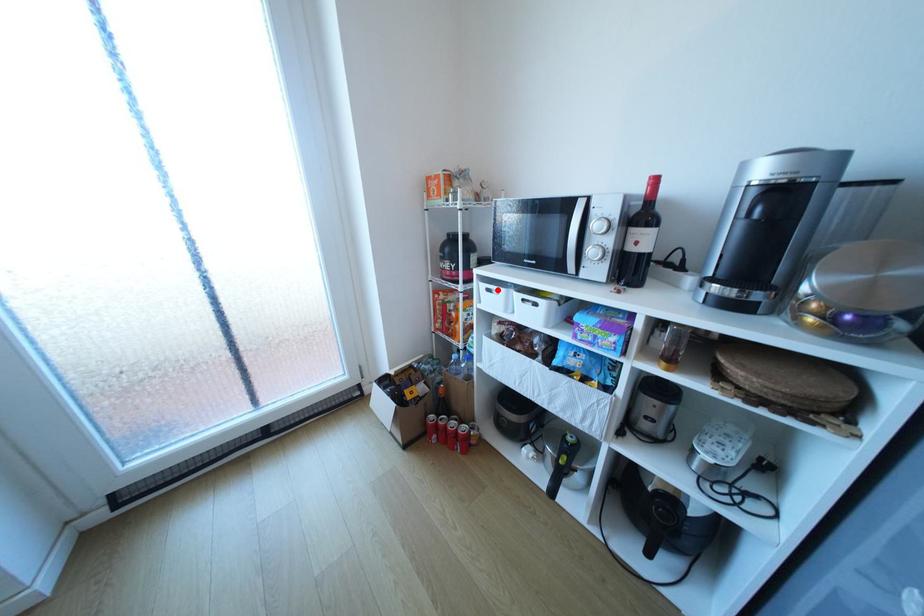
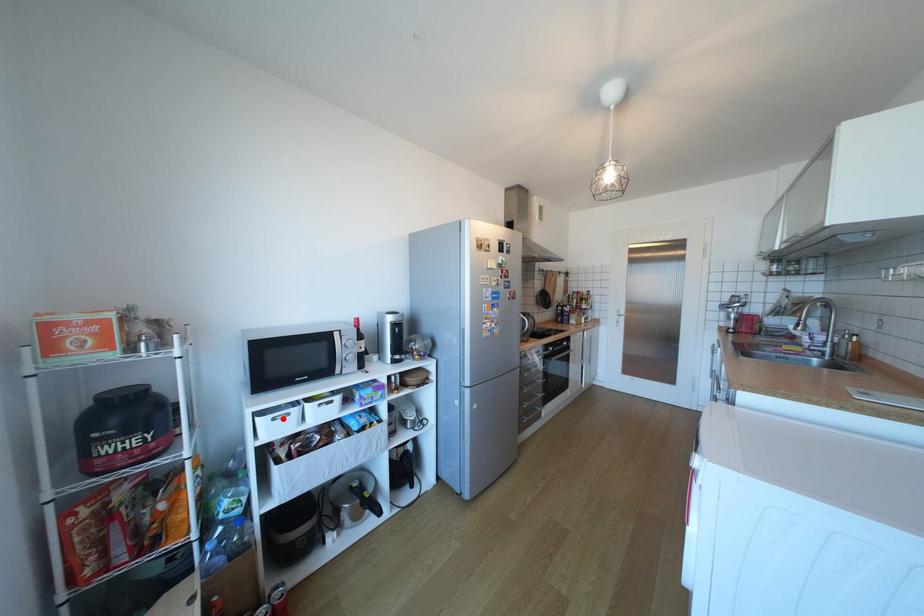
I am providing you with two images of the same scene from different viewpoints. A red point is marked on the first image and another point is marked on the second image. Is the marked point in image1 the same physical position as the marked point in image2?

Yes